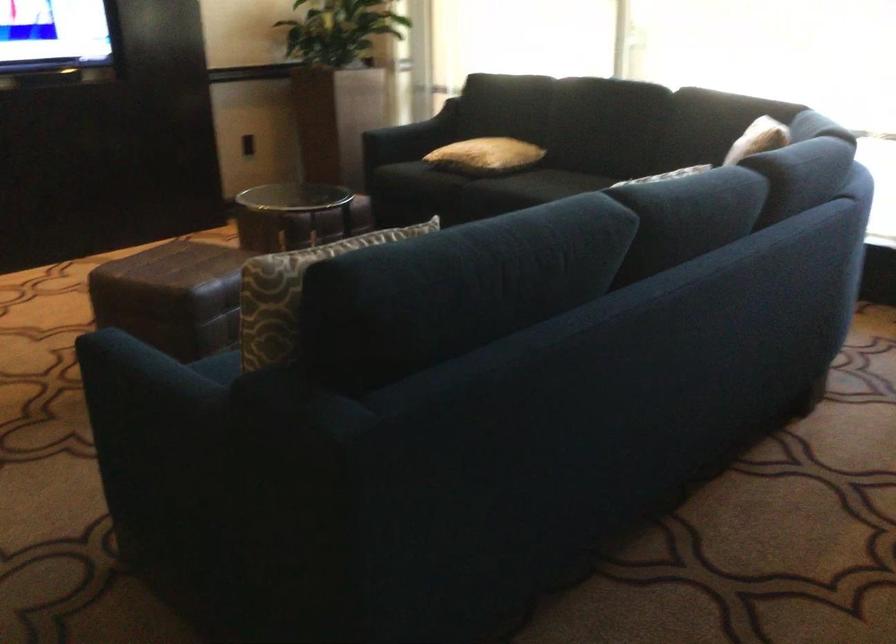
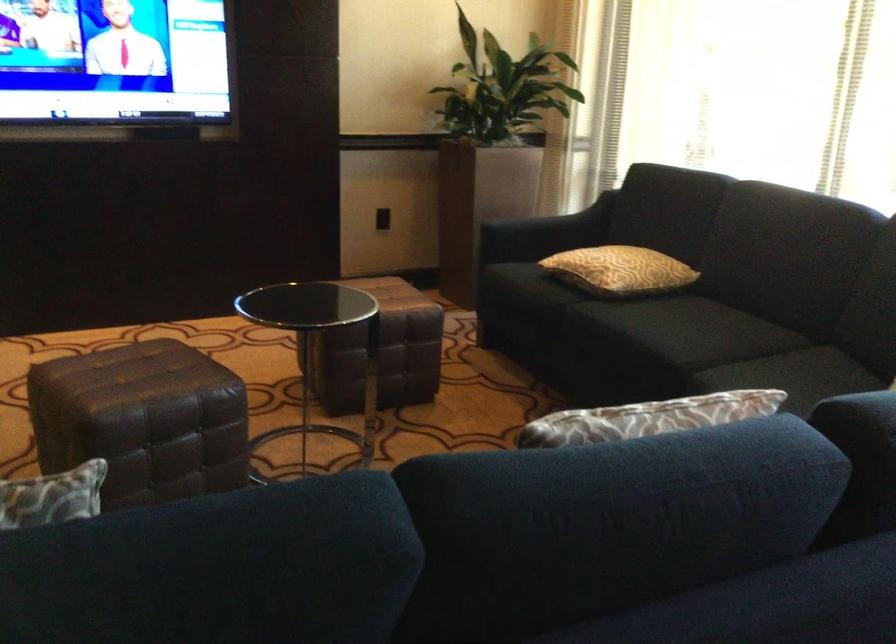
What movement of the cameraman would produce the second image?

The cameraman moved toward right, forward.